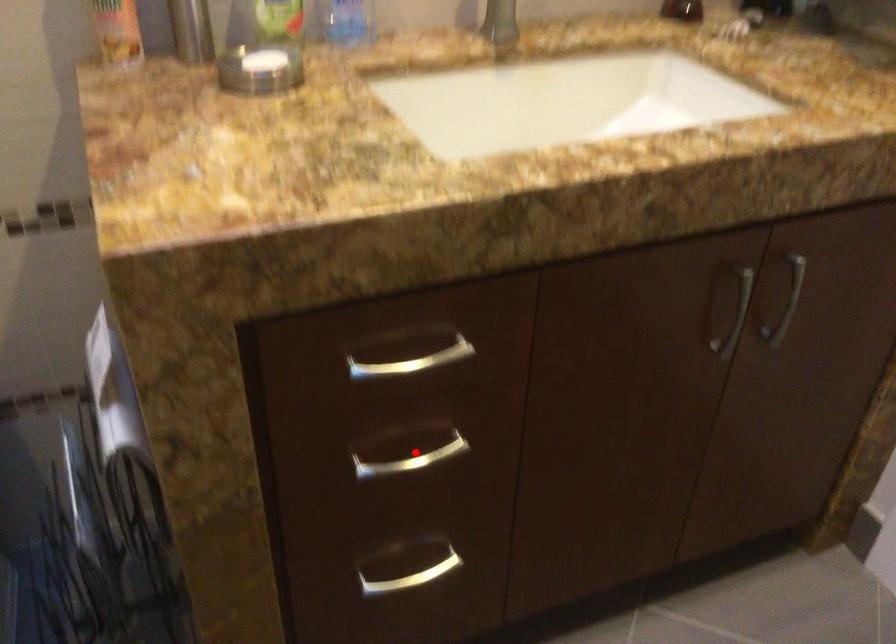
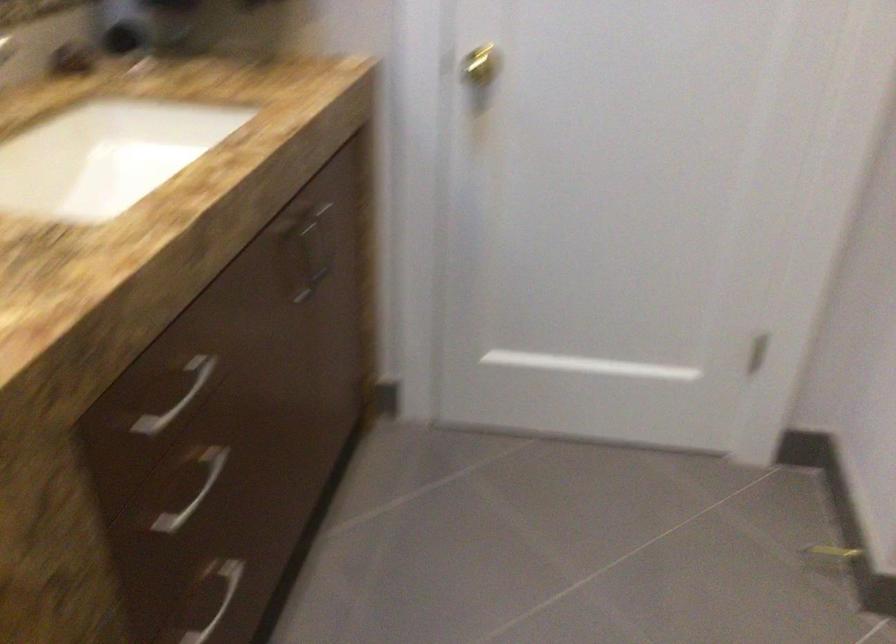
In the second image, find the point that corresponds to the highlighted location in the first image.

(187, 488)